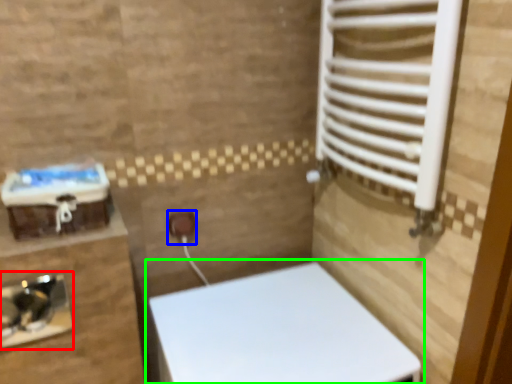
Question: Considering the real-world distances, which object is farthest from sink (highlighted by a red box)? electric outlet (highlighted by a blue box) or toilet (highlighted by a green box)?

Choices:
 (A) electric outlet
 (B) toilet

Answer: (B)